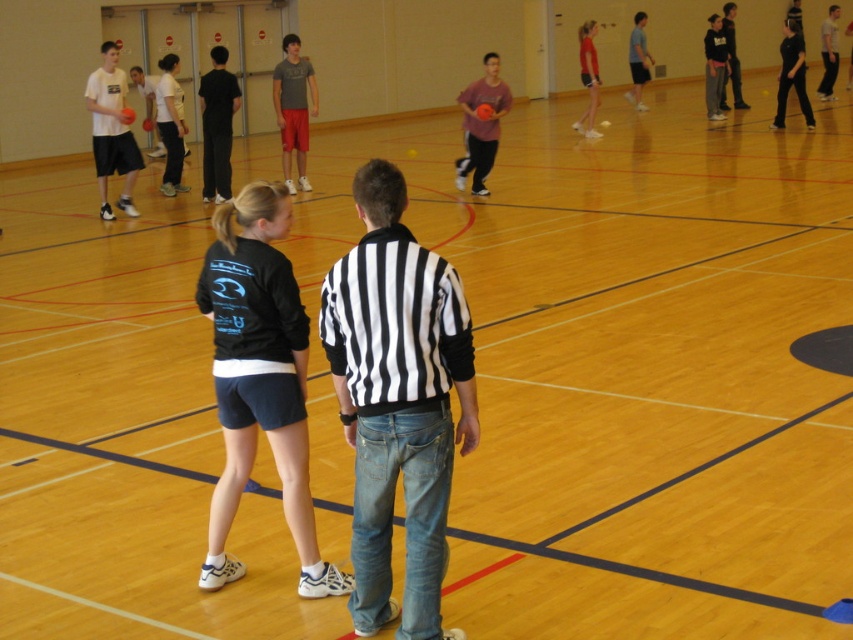
You are standing in the gymnasium and want to reach the point marked at coordinates (283, 509). If your walking speed is 3 feet per second, how many seconds will it take you to reach that point?

The distance between you and the point marked at coordinates (283, 509) is 16.85 feet. At a walking speed of 3 feet per second, it will take approximately 5.62 seconds to reach the point.